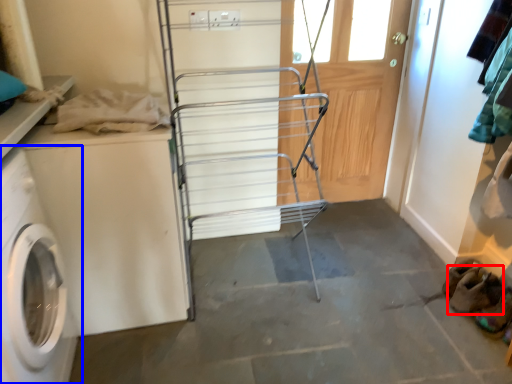
Question: Which object appears farthest to the camera in this image, shoe (highlighted by a red box) or washing machine (highlighted by a blue box)?

Choices:
 (A) shoe
 (B) washing machine

Answer: (A)